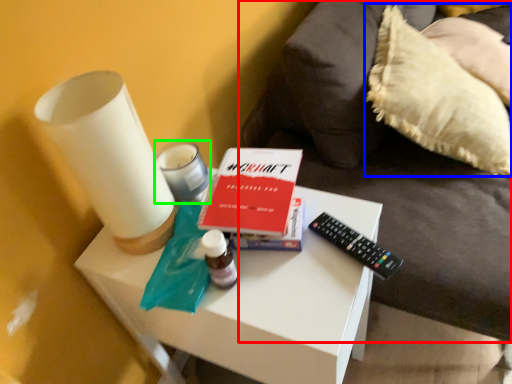
Question: Based on their relative distances, which object is farther from furniture (highlighted by a red box)? Choose from pillow (highlighted by a blue box) and candle holder (highlighted by a green box).

Choices:
 (A) pillow
 (B) candle holder

Answer: (B)